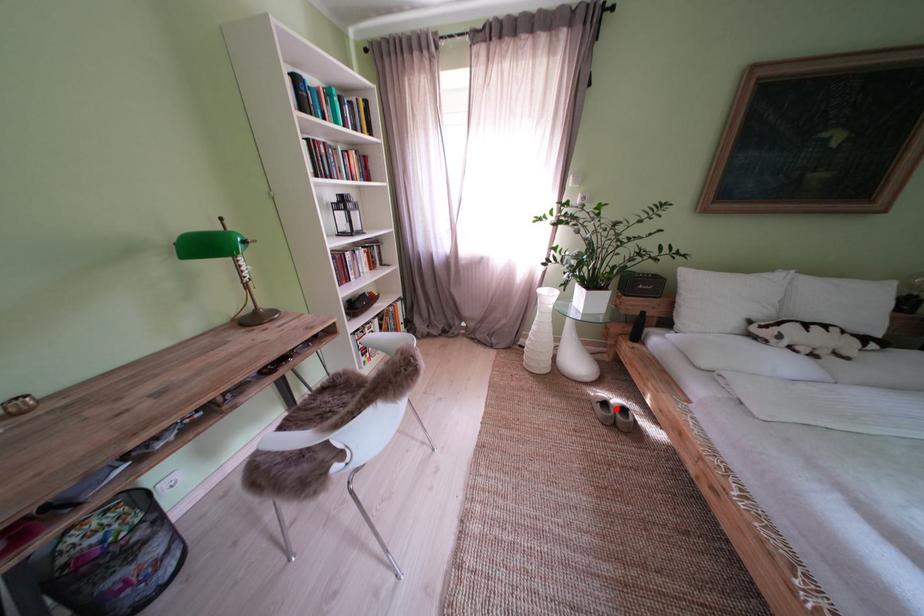
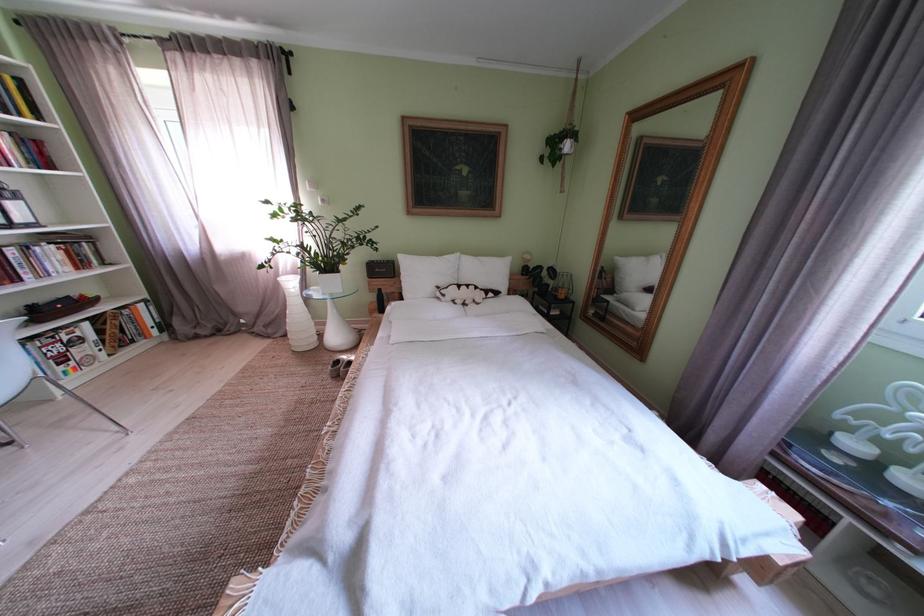
Question: I am providing you with two images of the same scene from different viewpoints. A red point is shown in image1. For the corresponding object point in image2, is it positioned nearer or farther from the camera?

Choices:
 (A) Nearer
 (B) Farther

Answer: (B)